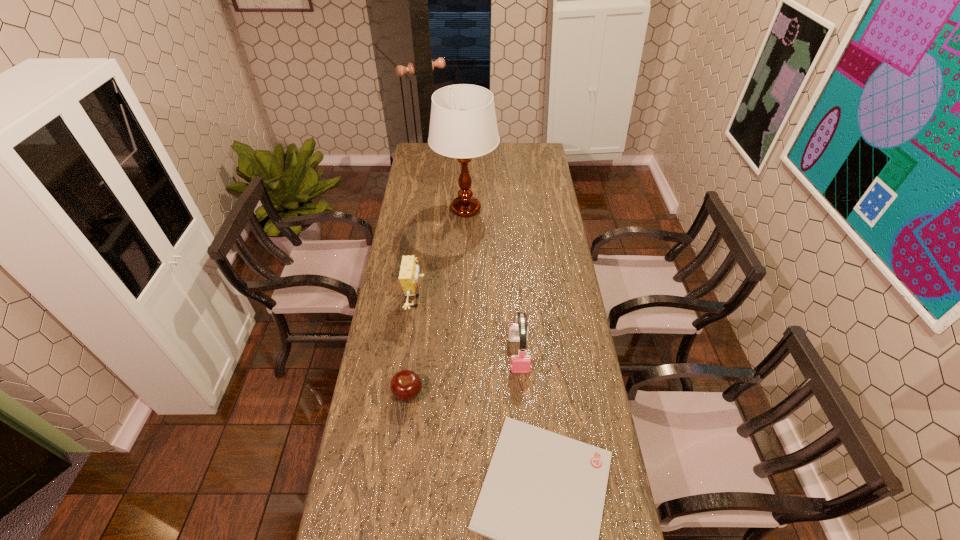
Where is `free space between the second nearest object and the third farthest object`? This screenshot has width=960, height=540. free space between the second nearest object and the third farthest object is located at coordinates (464, 374).

I want to click on vacant space that is in between the earphone and the farthest object, so click(x=492, y=282).

Find the location of a particular element. This screenshot has width=960, height=540. object identified as the third closest to the clipboard is located at coordinates (408, 275).

Find the location of a particular element. This screenshot has height=540, width=960. object that is the fourth closest to the table lamp is located at coordinates (542, 500).

Where is `vacant space that satisfies the following two spatial constraints: 1. on the back side of the second nearest object; 2. on the face of the sponge`? This screenshot has width=960, height=540. vacant space that satisfies the following two spatial constraints: 1. on the back side of the second nearest object; 2. on the face of the sponge is located at coordinates (420, 301).

Identify the location of free region that satisfies the following two spatial constraints: 1. on the face of the sponge; 2. on the left side of the fourth farthest object. The image size is (960, 540). (405, 394).

Identify the location of free space that satisfies the following two spatial constraints: 1. on the back side of the tallest object; 2. on the right side of the fourth farthest object. This screenshot has width=960, height=540. (431, 210).

Find the location of a particular element. This screenshot has height=540, width=960. vacant space that satisfies the following two spatial constraints: 1. on the face of the fourth farthest object; 2. on the left side of the sponge is located at coordinates (x=405, y=394).